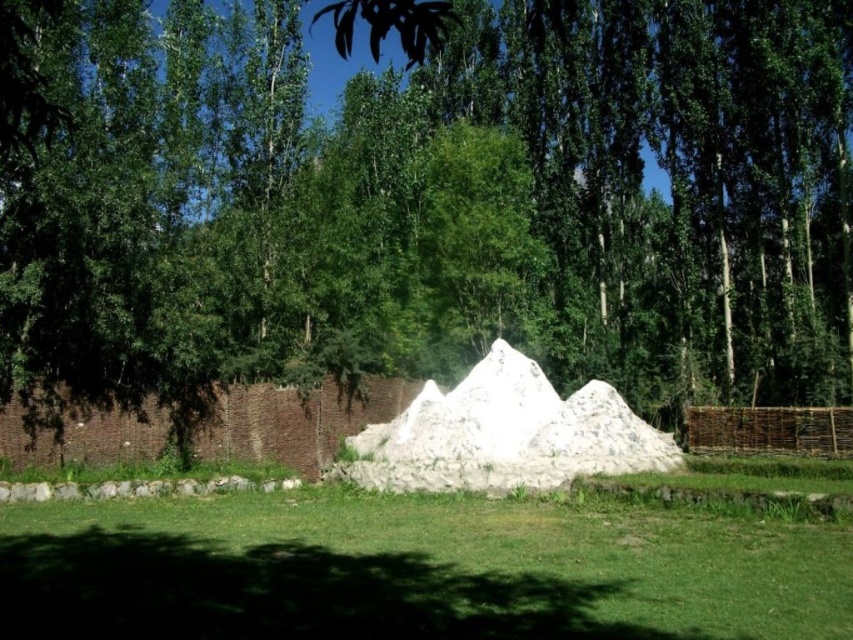
Question: Does green leafy tree at center have a smaller size compared to white sand pyramid at center?

Choices:
 (A) no
 (B) yes

Answer: (A)

Question: Which object is farther from the camera taking this photo?

Choices:
 (A) green leafy tree at center
 (B) green grass at center

Answer: (B)

Question: Which of the following is the closest to the observer?

Choices:
 (A) (526, 440)
 (B) (293, 563)

Answer: (B)

Question: Does green leafy tree at center have a smaller size compared to white sand pyramid at center?

Choices:
 (A) yes
 (B) no

Answer: (B)

Question: Does green leafy tree at center have a greater width compared to white sand pyramid at center?

Choices:
 (A) no
 (B) yes

Answer: (B)

Question: Which of these objects is positioned closest to the green grass at center?

Choices:
 (A) green leafy tree at center
 (B) white sand pyramid at center

Answer: (B)